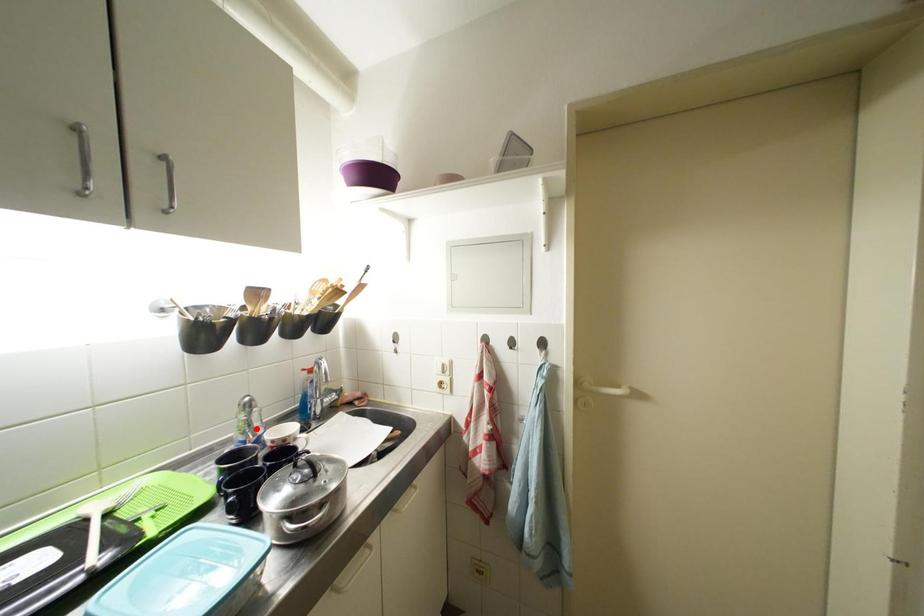
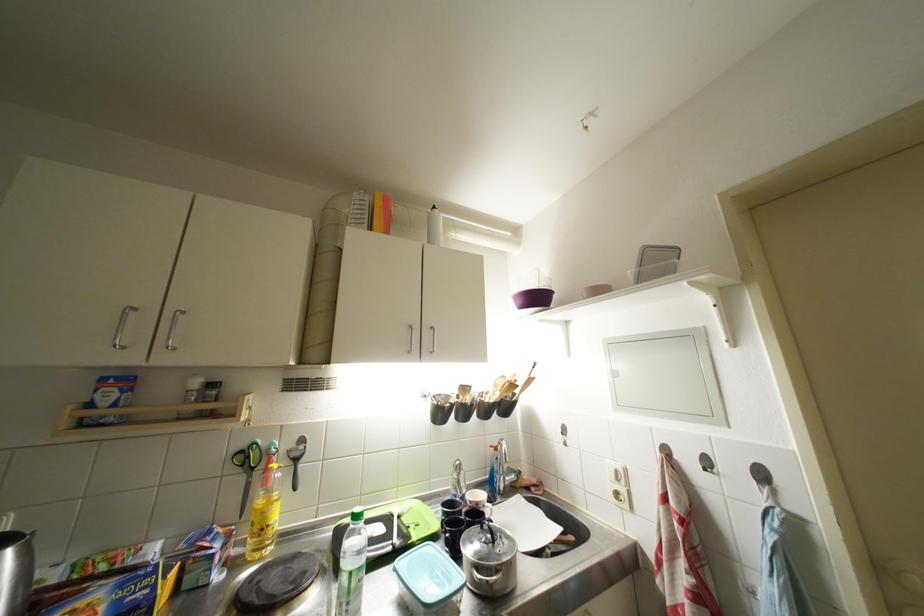
Question: I am providing you with two images of the same scene from different viewpoints. In image1, a red point is highlighted. Considering the same 3D point in image2, which of the following is correct?

Choices:
 (A) It is closer
 (B) It is farther

Answer: (B)